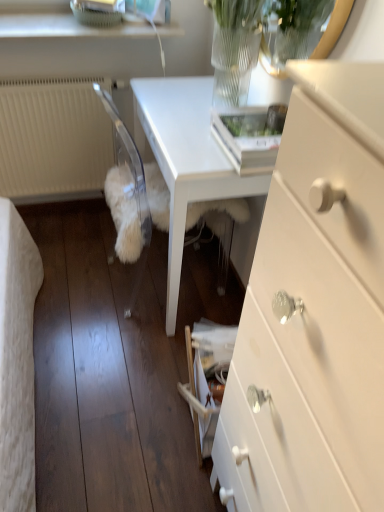
The height and width of the screenshot is (512, 384). In order to click on free spot in front of white fluffy dog at lower center in this screenshot , I will do (121, 360).